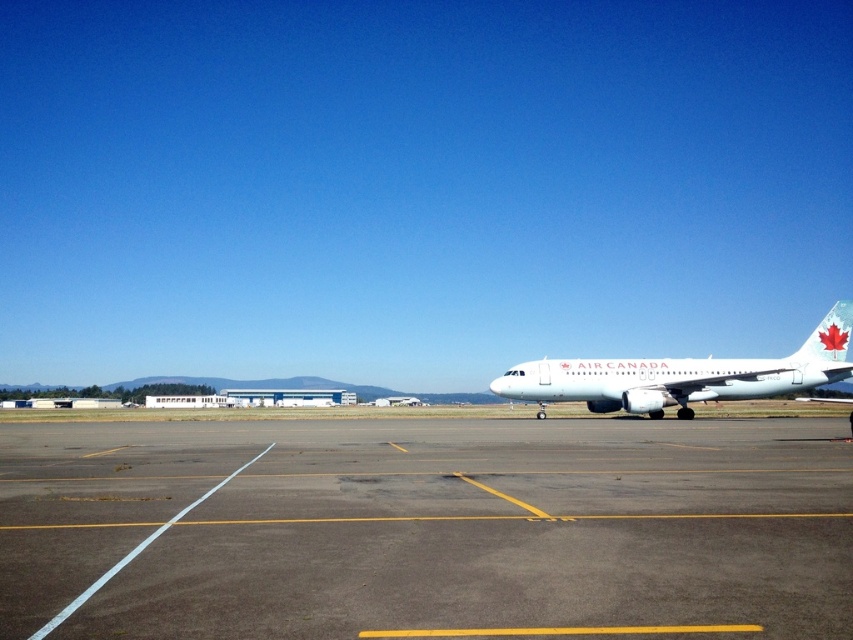
Based on the photo, does gray asphalt tarmac at center appear over white glossy airplane at right?

No, gray asphalt tarmac at center is not above white glossy airplane at right.

Where is `gray asphalt tarmac at center`? Image resolution: width=853 pixels, height=640 pixels. gray asphalt tarmac at center is located at coordinates (425, 529).

Is point (523, 428) behind point (517, 372)?

No, (523, 428) is closer to viewer.

At what (x,y) coordinates should I click in order to perform the action: click on gray asphalt tarmac at center. Please return your answer as a coordinate pair (x, y). The width and height of the screenshot is (853, 640). Looking at the image, I should click on (425, 529).